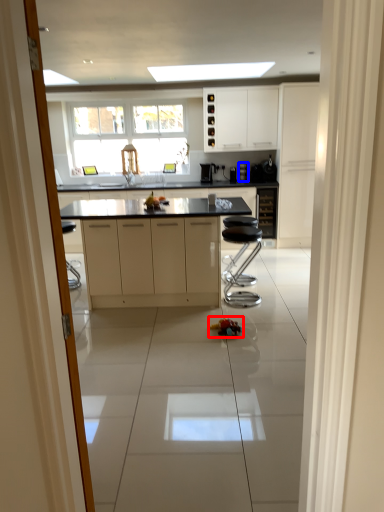
Question: Which object appears farthest to the camera in this image, toy (highlighted by a red box) or coffee machine (highlighted by a blue box)?

Choices:
 (A) toy
 (B) coffee machine

Answer: (B)